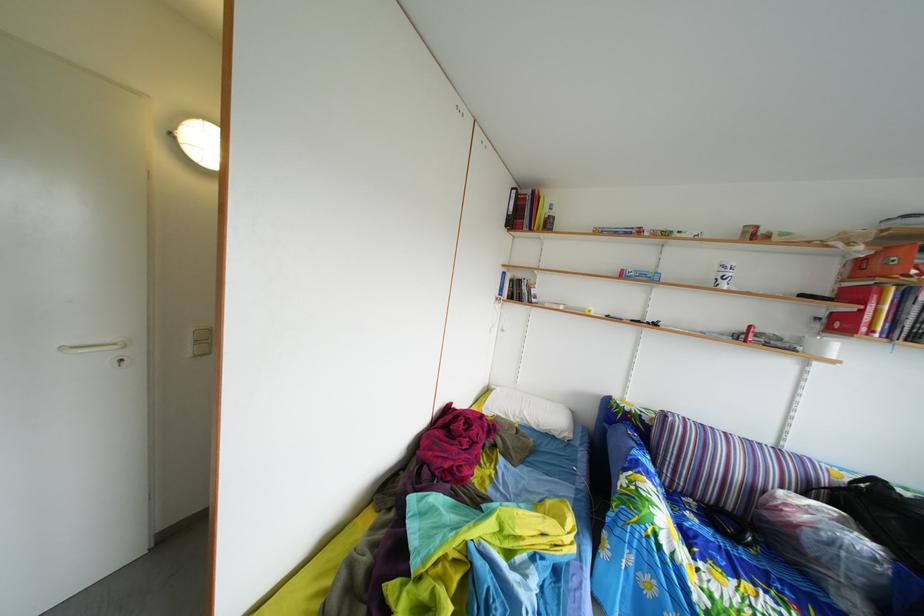
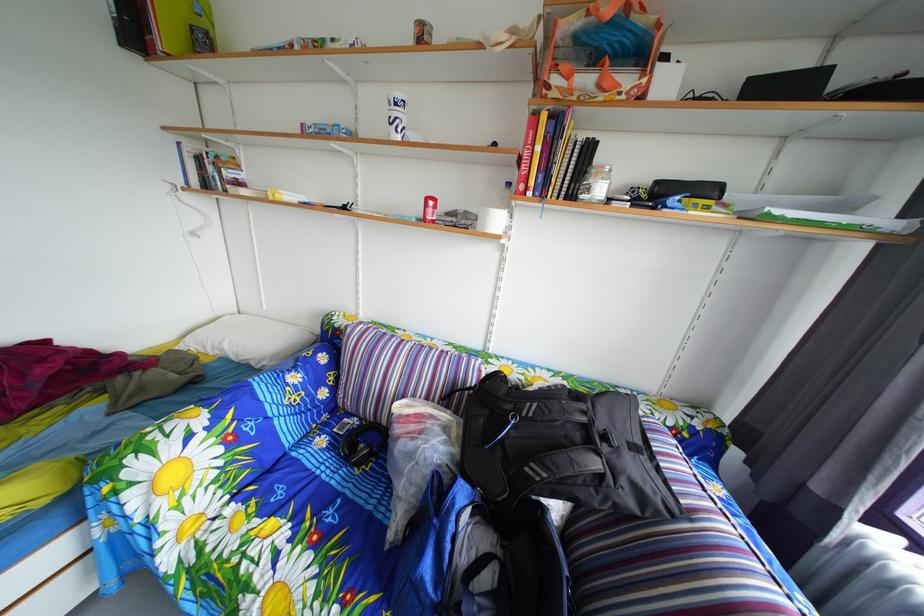
Find the pixel in the second image that matches (x=525, y=424) in the first image.

(224, 357)